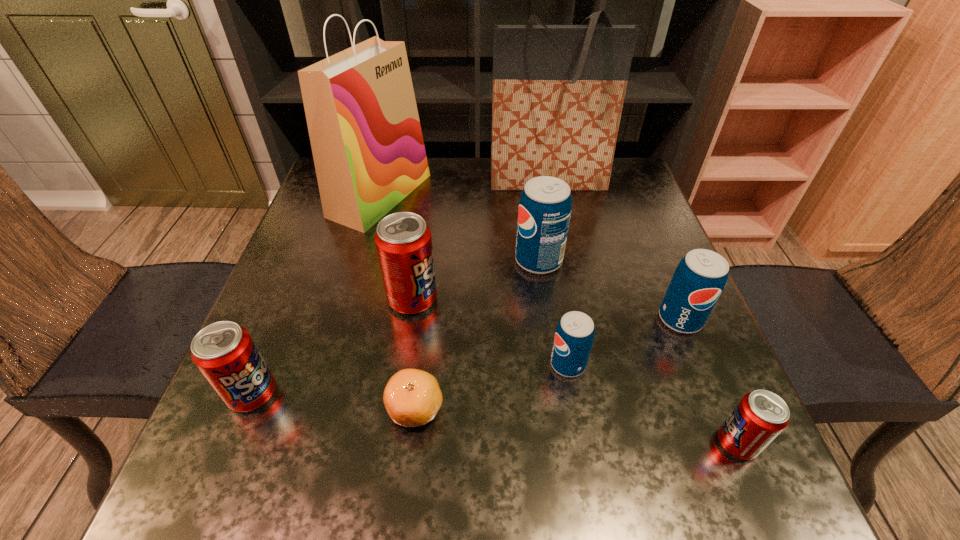
The width and height of the screenshot is (960, 540). In order to click on the nearest blue pop in this screenshot , I will do `click(574, 336)`.

In order to click on the smallest red soda can in this screenshot , I will do `click(761, 415)`.

Locate an element on the screen. the nearest soda can is located at coordinates (761, 415).

Locate an element on the screen. The height and width of the screenshot is (540, 960). clementine is located at coordinates (412, 398).

Image resolution: width=960 pixels, height=540 pixels. In order to click on orange clementine in this screenshot , I will do `click(412, 398)`.

Identify the location of blank space located on the right of the left shopping bag. (483, 195).

I want to click on free space located on the front-facing side of the right shopping bag, so click(570, 294).

Find the location of a particular element. vacant point located on the right of the farthest blue pop is located at coordinates (645, 260).

Locate an element on the screen. vacant space located on the left of the farthest red soda can is located at coordinates tap(307, 299).

Where is `vacant point located on the left of the rightmost blue pop`? vacant point located on the left of the rightmost blue pop is located at coordinates (609, 319).